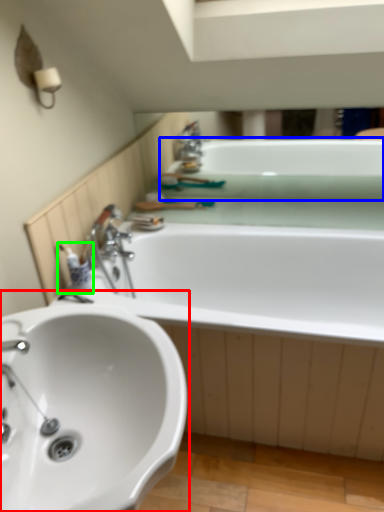
Question: Estimate the real-world distances between objects in this image. Which object is farther from sink (highlighted by a red box), bath (highlighted by a blue box) or toiletry (highlighted by a green box)?

Choices:
 (A) bath
 (B) toiletry

Answer: (A)